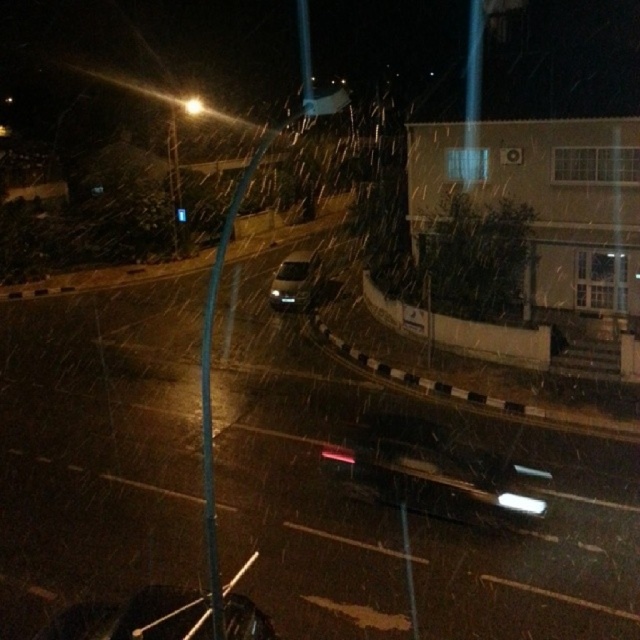
You are a pedestrian standing at the blue glass traffic light at upper center, wanting to cross the street. The shiny black car at lower left is parked there. Which side of the traffic light is the car located on?

The shiny black car at lower left is positioned on the right side of blue glass traffic light at upper center, so the car is on the right side of the traffic light.